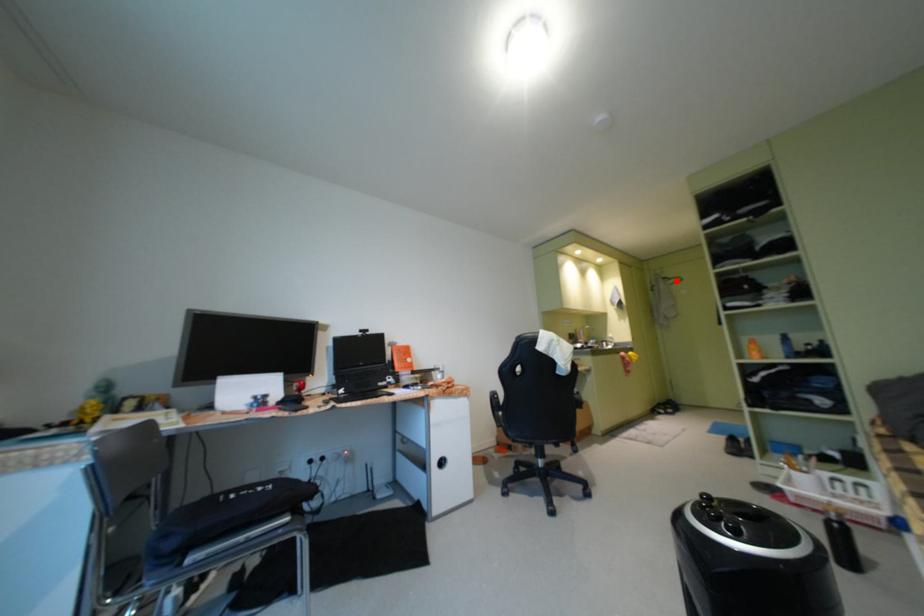
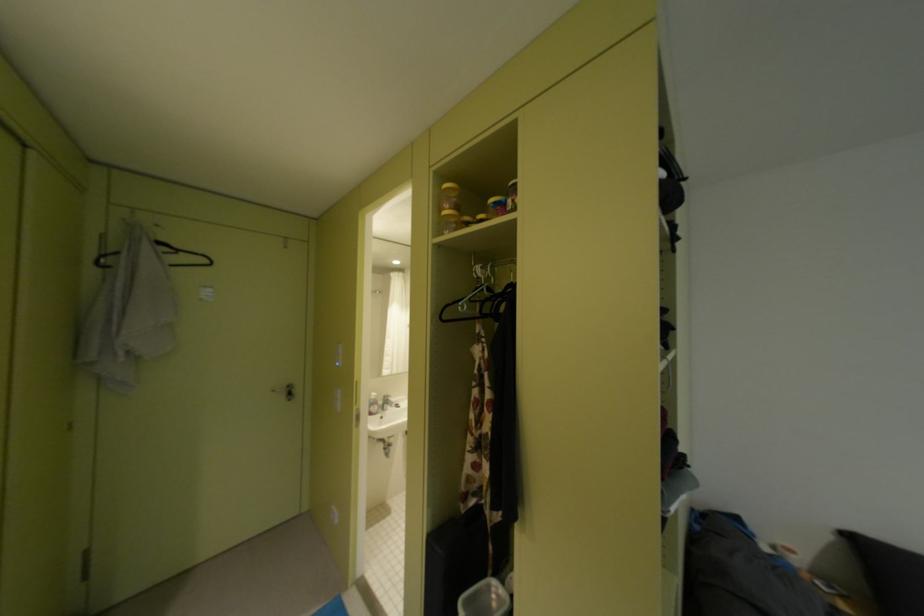
Find the pixel in the second image that matches the highlighted location in the first image.

(175, 249)